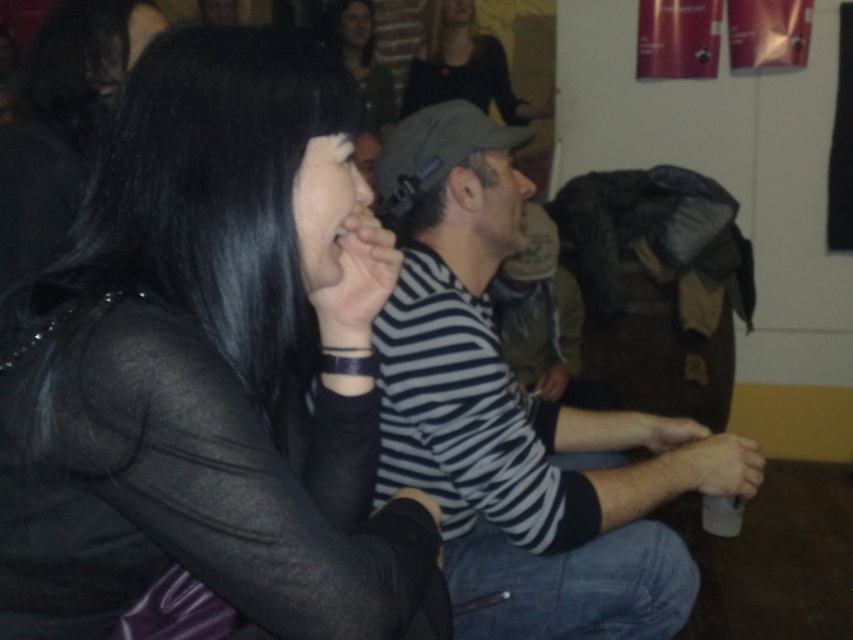
Question: Which of the following is the farthest from the observer?

Choices:
 (A) (79, 556)
 (B) (611, 420)
 (C) (479, 80)

Answer: (C)

Question: Which of these objects is positioned closest to the black matte wristband at center?

Choices:
 (A) white matte cup at lower center
 (B) striped fabric shirt at center
 (C) dry skin hand at lower center

Answer: (B)

Question: Is matte black hair at upper center further to camera compared to matte black hand at center?

Choices:
 (A) no
 (B) yes

Answer: (B)

Question: Is black matte jacket at upper left wider than matte black hand at center?

Choices:
 (A) yes
 (B) no

Answer: (A)

Question: Which point is farther to the camera?

Choices:
 (A) dry skin hand at lower center
 (B) black matte wristband at center

Answer: (A)

Question: Does black matte jacket at upper left appear on the right side of dry skin hand at lower center?

Choices:
 (A) no
 (B) yes

Answer: (A)